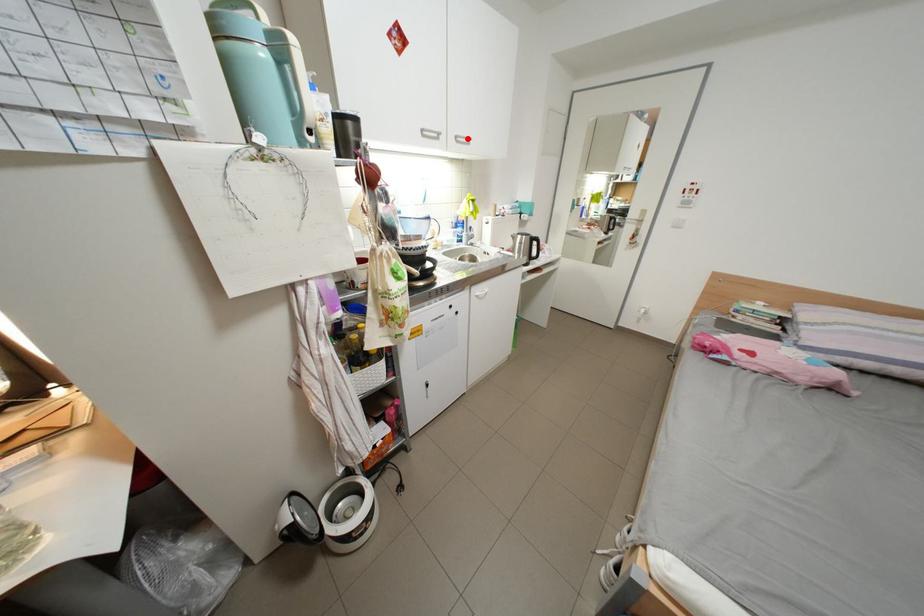
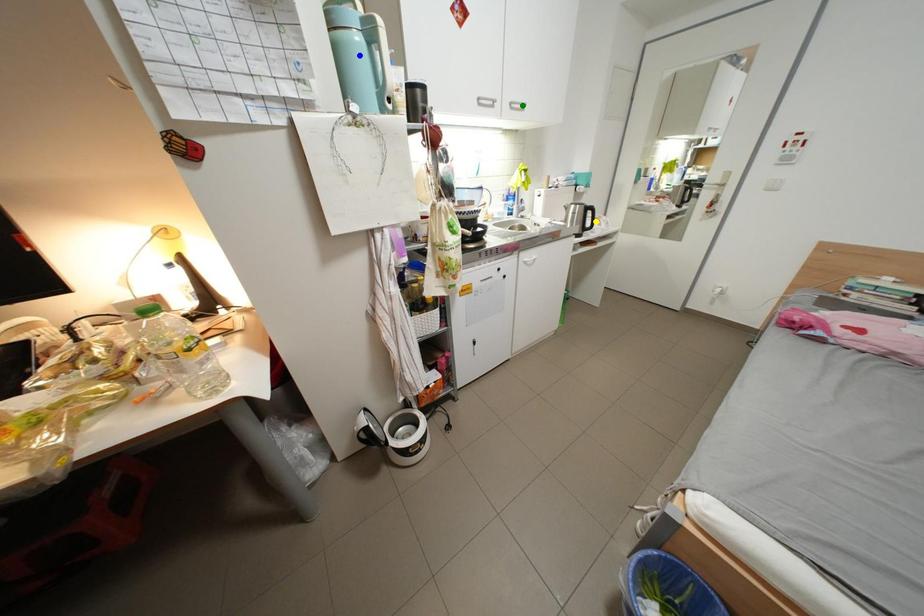
Question: I am providing you with two images of the same scene from different viewpoints. A red point is marked on the first image. You are given multiple points on the second image. Which mark in image 2 goes with the point in image 1?

Choices:
 (A) green point
 (B) blue point
 (C) yellow point

Answer: (A)